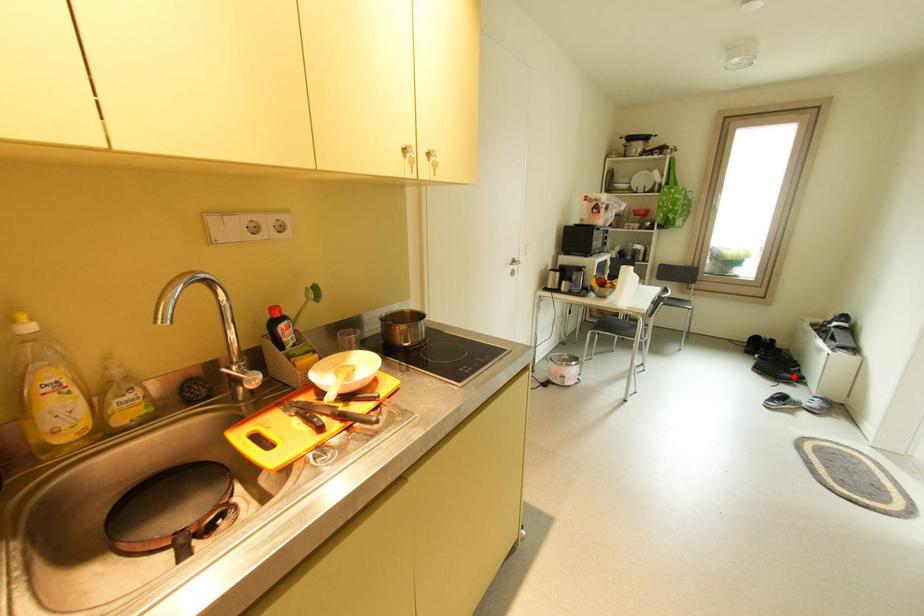
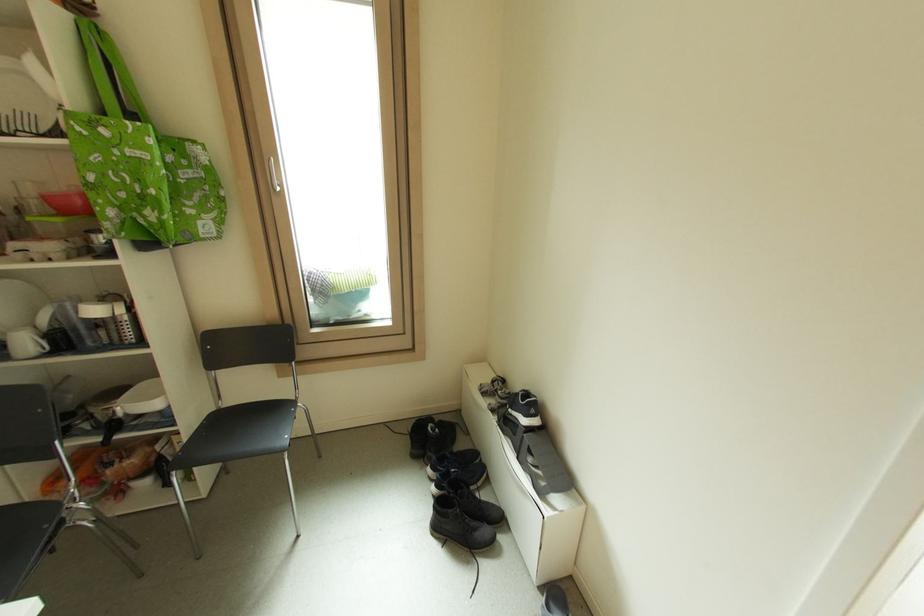
Find the pixel in the second image that matches the highlighted location in the first image.

(490, 532)